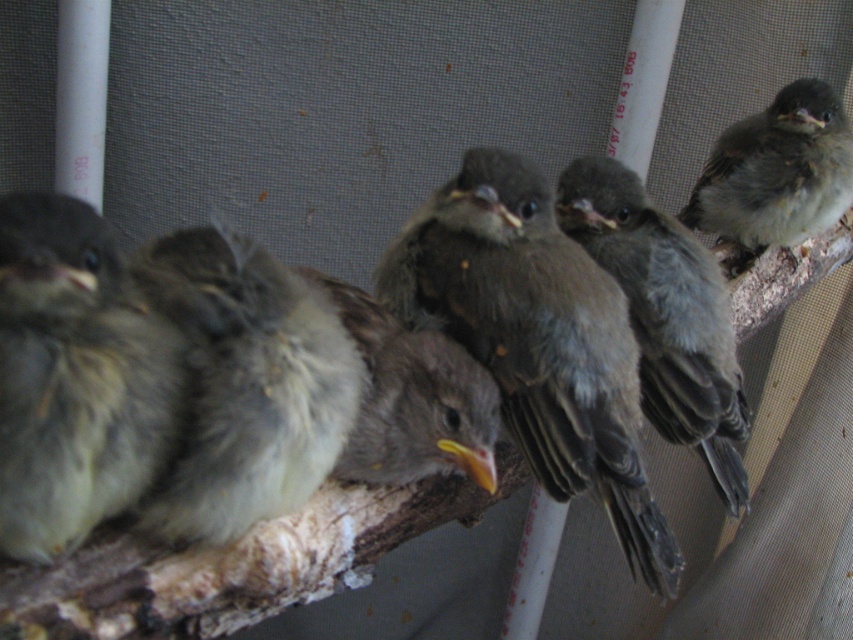
Who is lower down, soft gray downy feathers at left or gray downy feathers at center?

soft gray downy feathers at left is lower down.

Is soft gray downy feathers at left taller than gray downy feathers at center?

Incorrect, soft gray downy feathers at left's height is not larger of gray downy feathers at center's.

Which is behind, point (114, 300) or point (682, 413)?

The point (682, 413) is behind.

I want to click on soft gray downy feathers at left, so click(74, 378).

Does soft gray downy feathers at left have a lesser height compared to gray fluffy bird at center?

No.

Can you confirm if soft gray downy feathers at left is smaller than gray fluffy bird at center?

Yes, soft gray downy feathers at left is smaller than gray fluffy bird at center.

Which is behind, point (64, 432) or point (234, 384)?

The point (234, 384) is more distant.

The height and width of the screenshot is (640, 853). I want to click on soft gray downy feathers at left, so click(x=74, y=378).

Is soft gray downy feathers at left thinner than brown fluffy bird at center?

Correct, soft gray downy feathers at left's width is less than brown fluffy bird at center's.

Is soft gray downy feathers at left bigger than brown fluffy bird at center?

Incorrect, soft gray downy feathers at left is not larger than brown fluffy bird at center.

Between point (94, 353) and point (366, 355), which one is positioned in front?

Point (94, 353)

At what (x,y) coordinates should I click in order to perform the action: click on soft gray downy feathers at left. Please return your answer as a coordinate pair (x, y). Looking at the image, I should click on [x=74, y=378].